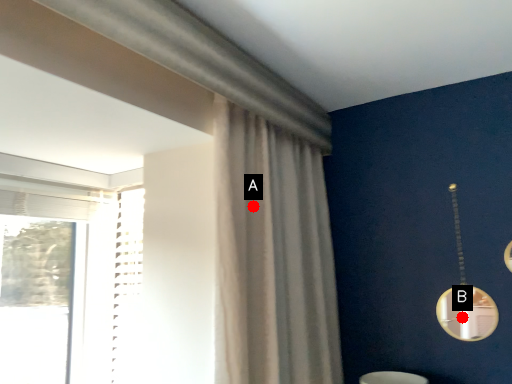
Question: Two points are circled on the image, labeled by A and B beside each circle. Which point is closer to the camera taking this photo?

Choices:
 (A) A is closer
 (B) B is closer

Answer: (A)